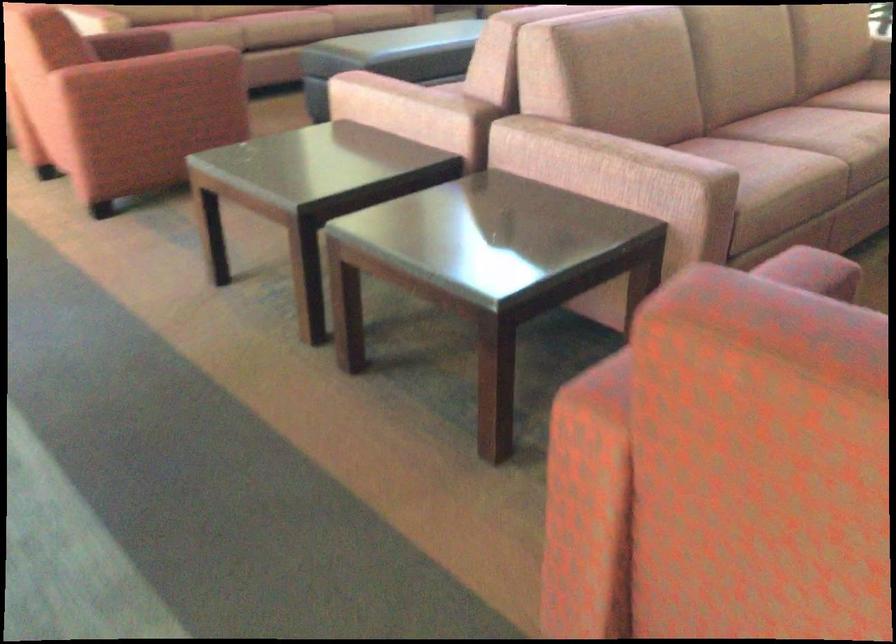
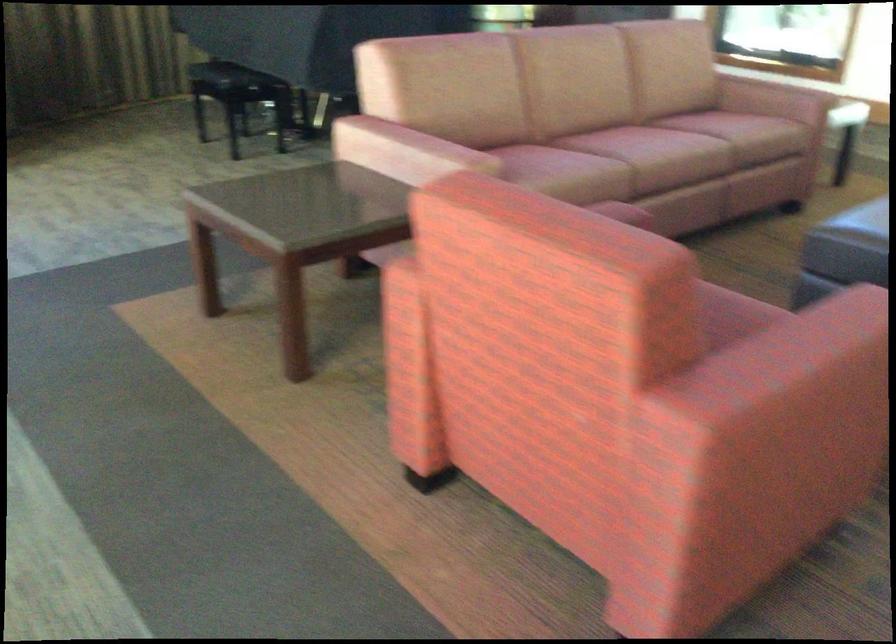
The images are taken continuously from a first-person perspective. In which direction are you moving?

The movement direction of the cameraman is left, forward.